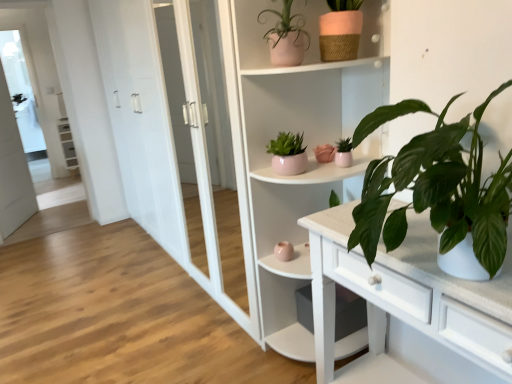
This screenshot has height=384, width=512. What are the coordinates of `white glass window at upper left` in the screenshot? It's located at (21, 91).

Measure the distance between matte pink pot at center, which is counted as the 2th houseplant, starting from the bottom, and camera.

matte pink pot at center, which is counted as the 2th houseplant, starting from the bottom, is 5.87 feet away from camera.

Describe the element at coordinates (304, 144) in the screenshot. I see `white matte bookshelf at center` at that location.

Identify the location of white matte bookshelf at center. (304, 144).

What do you see at coordinates (13, 170) in the screenshot? I see `white glass screen door at left` at bounding box center [13, 170].

You are a GUI agent. You are given a task and a screenshot of the screen. Output one action in this format:
    pyautogui.click(x=<x>, y=<y>)
    Task: Click on the matte pink pot at upper center, which is the 1th houseplant in top-to-bottom order
    
    Given the screenshot: What is the action you would take?
    pyautogui.click(x=286, y=37)

Identify the location of matte pink pot at upper center, the third houseplant from the bottom. The height and width of the screenshot is (384, 512). (288, 154).

From a real-world perspective, is white glass window at upper left over pink woven flowerpot at upper center?

Incorrect, from a real-world perspective, white glass window at upper left is lower than pink woven flowerpot at upper center.

Is white glass window at upper left looking in the opposite direction of pink woven flowerpot at upper center?

No, white glass window at upper left is not facing away from pink woven flowerpot at upper center.

How different are the orientations of white glass window at upper left and pink woven flowerpot at upper center in degrees?

The angle between the facing direction of white glass window at upper left and the facing direction of pink woven flowerpot at upper center is 79.2 degrees.

In the scene shown: Does white glass window at upper left touch pink woven flowerpot at upper center?

No, white glass window at upper left is not touching pink woven flowerpot at upper center.

What's the angular difference between white glass screen door at left and matte pink pot at center, which is counted as the 3th houseplant, starting from the top,'s facing directions?

The angle between the facing direction of white glass screen door at left and the facing direction of matte pink pot at center, which is counted as the 3th houseplant, starting from the top, is 120 degrees.

Is white glass screen door at left shorter than matte pink pot at center, which is counted as the 3th houseplant, starting from the top?

Incorrect, the height of white glass screen door at left does not fall short of that of matte pink pot at center, which is counted as the 3th houseplant, starting from the top.

Does white glass screen door at left touch matte pink pot at center, which is counted as the 3th houseplant, starting from the top?

No, white glass screen door at left is not making contact with matte pink pot at center, which is counted as the 3th houseplant, starting from the top.

Does white glass screen door at left come behind matte pink pot at center, which is counted as the 2th houseplant, starting from the bottom?

Yes, white glass screen door at left is behind matte pink pot at center, which is counted as the 2th houseplant, starting from the bottom.

Considering the relative sizes of matte pink pot at center, which is counted as the 3th houseplant, starting from the top, and pink woven flowerpot at upper center in the image provided, is matte pink pot at center, which is counted as the 3th houseplant, starting from the top, taller than pink woven flowerpot at upper center?

Incorrect, the height of matte pink pot at center, which is counted as the 3th houseplant, starting from the top, is not larger of that of pink woven flowerpot at upper center.

Who is bigger, matte pink pot at center, which is counted as the 2th houseplant, starting from the bottom, or pink woven flowerpot at upper center?

pink woven flowerpot at upper center is bigger.

How many degrees apart are the facing directions of matte pink pot at center, which is counted as the 3th houseplant, starting from the top, and pink woven flowerpot at upper center?

They differ by 19.8 degrees in their facing directions.

From the image's perspective, which one is positioned lower, matte pink pot at center, which is counted as the 2th houseplant, starting from the bottom, or pink woven flowerpot at upper center?

From the image's view, matte pink pot at center, which is counted as the 2th houseplant, starting from the bottom, is below.

Can you confirm if matte gray cabinet at left is wider than matte pink pot at upper center, the third houseplant from the bottom?

Correct, the width of matte gray cabinet at left exceeds that of matte pink pot at upper center, the third houseplant from the bottom.

Based on the photo, would you say matte gray cabinet at left contains matte pink pot at upper center, marked as the second houseplant in a top-to-bottom arrangement?

No.

Is matte gray cabinet at left behind matte pink pot at upper center, marked as the second houseplant in a top-to-bottom arrangement?

Yes, matte gray cabinet at left is further from the camera.

Is matte gray cabinet at left positioned far away from matte pink pot at upper center, the third houseplant from the bottom?

Yes, matte gray cabinet at left is far from matte pink pot at upper center, the third houseplant from the bottom.

Is white matte bookshelf at center inside the boundaries of matte gray cabinet at left, or outside?

white matte bookshelf at center is not enclosed by matte gray cabinet at left.

Are white matte bookshelf at center and matte gray cabinet at left located far from each other?

That's right, there is a large distance between white matte bookshelf at center and matte gray cabinet at left.

Who is bigger, pink woven flowerpot at upper center or matte pink pot at center, which is counted as the 3th houseplant, starting from the top?

pink woven flowerpot at upper center.

In the image, there is a matte pink pot at center, which is counted as the 2th houseplant, starting from the bottom. Where is `flowerpot above it (from the image's perspective)`? Image resolution: width=512 pixels, height=384 pixels. flowerpot above it (from the image's perspective) is located at coordinates [x=340, y=35].

Is pink woven flowerpot at upper center oriented away from matte pink pot at center, which is counted as the 3th houseplant, starting from the top?

pink woven flowerpot at upper center does not have its back to matte pink pot at center, which is counted as the 3th houseplant, starting from the top.

Considering the sizes of objects green leafy plant at right, which ranks as the first houseplant in bottom-to-top order, and matte gray cabinet at left in the image provided, who is thinner, green leafy plant at right, which ranks as the first houseplant in bottom-to-top order, or matte gray cabinet at left?

matte gray cabinet at left is thinner.

Does green leafy plant at right, which ranks as the first houseplant in bottom-to-top order, lie in front of matte gray cabinet at left?

Yes, it is in front of matte gray cabinet at left.

Based on the photo, is green leafy plant at right, which is counted as the fourth houseplant, starting from the top, smaller than matte gray cabinet at left?

No, green leafy plant at right, which is counted as the fourth houseplant, starting from the top, is not smaller than matte gray cabinet at left.

Consider the image. From the image's perspective, is green leafy plant at right, which ranks as the first houseplant in bottom-to-top order, below matte gray cabinet at left?

Indeed, from the image's perspective, green leafy plant at right, which ranks as the first houseplant in bottom-to-top order, is shown beneath matte gray cabinet at left.

This screenshot has height=384, width=512. What are the coordinates of `window on the left of pink woven flowerpot at upper center` in the screenshot? It's located at (21, 91).

Where is `the 3rd houseplant below the white glass screen door at left (from the image's perspective)`? The width and height of the screenshot is (512, 384). the 3rd houseplant below the white glass screen door at left (from the image's perspective) is located at coordinates (343, 153).

From the image, which object appears to be farther from matte gray cabinet at left, matte pink pot at upper center, marked as the second houseplant in a top-to-bottom arrangement, or white glass window at upper left?

The object further to matte gray cabinet at left is matte pink pot at upper center, marked as the second houseplant in a top-to-bottom arrangement.

Looking at the image, which one is located further to white matte bookshelf at center, matte pink pot at center, which is counted as the 2th houseplant, starting from the bottom, or matte gray cabinet at left?

The object further to white matte bookshelf at center is matte gray cabinet at left.

Based on their spatial positions, is green leafy plant at right, which is counted as the fourth houseplant, starting from the top, or matte gray cabinet at left closer to white glass window at upper left?

matte gray cabinet at left.

In the scene shown: When comparing their distances from green leafy plant at right, which is counted as the fourth houseplant, starting from the top, does pink woven flowerpot at upper center or matte pink pot at center, which is counted as the 3th houseplant, starting from the top, seem further?

Among the two, pink woven flowerpot at upper center is located further to green leafy plant at right, which is counted as the fourth houseplant, starting from the top.

Which object lies nearer to the anchor point matte gray cabinet at left, matte pink pot at upper center, which is the 1th houseplant in top-to-bottom order, or white glass window at upper left?

white glass window at upper left is closer to matte gray cabinet at left.

Which object lies further to the anchor point green leafy plant at right, which is counted as the fourth houseplant, starting from the top, matte gray cabinet at left or white glass screen door at left?

matte gray cabinet at left lies further to green leafy plant at right, which is counted as the fourth houseplant, starting from the top, than the other object.

In the scene shown: When comparing their distances from matte gray cabinet at left, does green leafy plant at right, which ranks as the first houseplant in bottom-to-top order, or matte pink pot at center, which is counted as the 3th houseplant, starting from the top, seem closer?

Among the two, matte pink pot at center, which is counted as the 3th houseplant, starting from the top, is located nearer to matte gray cabinet at left.

Which object lies further to the anchor point matte pink pot at center, which is counted as the 3th houseplant, starting from the top, matte pink pot at upper center, which is the 1th houseplant in top-to-bottom order, or matte gray cabinet at left?

Among the two, matte gray cabinet at left is located further to matte pink pot at center, which is counted as the 3th houseplant, starting from the top.

Where is `bookshelf between white glass screen door at left and matte pink pot at center, which is counted as the 2th houseplant, starting from the bottom, in the horizontal direction`? bookshelf between white glass screen door at left and matte pink pot at center, which is counted as the 2th houseplant, starting from the bottom, in the horizontal direction is located at coordinates (304, 144).

At what (x,y) coordinates should I click in order to perform the action: click on window between matte pink pot at center, which is counted as the 2th houseplant, starting from the bottom, and matte gray cabinet at left, along the z-axis. Please return your answer as a coordinate pair (x, y). The width and height of the screenshot is (512, 384). Looking at the image, I should click on (21, 91).

Identify the location of houseplant located between green leafy plant at right, which is counted as the fourth houseplant, starting from the top, and pink woven flowerpot at upper center in the depth direction. (286, 37).

I want to click on bookshelf between green leafy plant at right, which ranks as the first houseplant in bottom-to-top order, and matte gray cabinet at left, along the z-axis, so click(x=304, y=144).